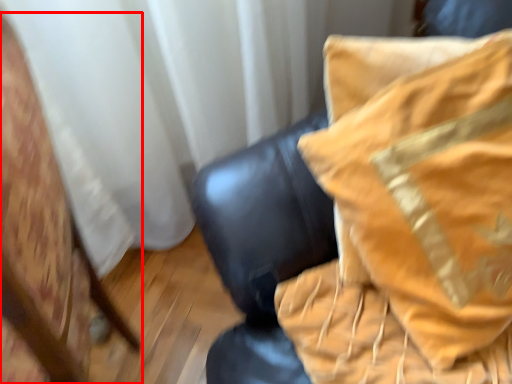
Question: From the image's perspective, what is the correct spatial positioning of furniture (annotated by the red box) in reference to furniture?

Choices:
 (A) below
 (B) above

Answer: (A)